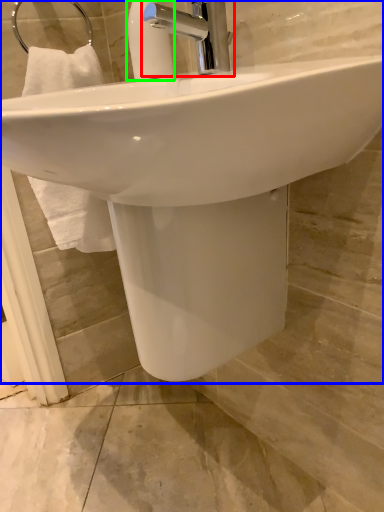
Question: Which object is the farthest from tap (highlighted by a red box)? Choose among these: sink (highlighted by a blue box) or soap dispenser (highlighted by a green box).

Choices:
 (A) sink
 (B) soap dispenser

Answer: (A)